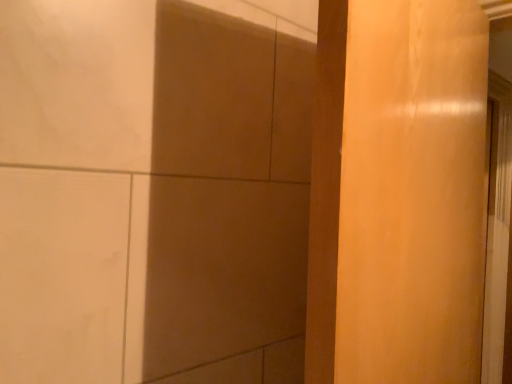
Describe the element at coordinates (412, 193) in the screenshot. I see `glossy wood elevator door at right` at that location.

Locate an element on the screen. The height and width of the screenshot is (384, 512). glossy wood elevator door at right is located at coordinates (412, 193).

This screenshot has height=384, width=512. In order to click on glossy wood elevator door at right in this screenshot , I will do `click(412, 193)`.